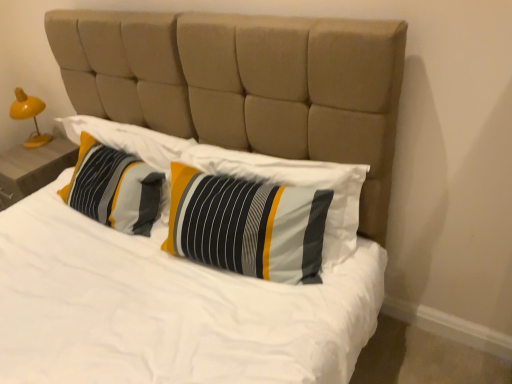
Measure the distance between point (18, 178) and camera.

The distance of point (18, 178) from camera is 2.19 meters.

At what (x,y) coordinates should I click in order to perform the action: click on yellow plastic lamp at left. Please return your answer as a coordinate pair (x, y). Looking at the image, I should click on (29, 116).

At what (x,y) coordinates should I click in order to perform the action: click on striped fabric pillow at center, the second pillow in the left-to-right sequence. Please return your answer as a coordinate pair (x, y). Looking at the image, I should click on (247, 225).

How much space does striped fabric pillow at center, which ranks as the 2th pillow in right-to-left order, occupy horizontally?

striped fabric pillow at center, which ranks as the 2th pillow in right-to-left order, is 9.61 inches in width.

At what (x,y) coordinates should I click in order to perform the action: click on yellow wood nightstand at left. Please return your answer as a coordinate pair (x, y). Looking at the image, I should click on pyautogui.click(x=33, y=168).

Can you tell me how much yellow plastic lamp at left and yellow wood nightstand at left differ in facing direction?

They differ by 1 degrees in their facing directions.

Is yellow plastic lamp at left facing away from yellow wood nightstand at left?

yellow plastic lamp at left does not have its back to yellow wood nightstand at left.

Find the location of `bedside lamp above the yellow wood nightstand at left (from the image's perspective)`. bedside lamp above the yellow wood nightstand at left (from the image's perspective) is located at coordinates (29, 116).

Looking at this image, which is closer, (16, 93) or (15, 172)?

The point (15, 172) is closer to the camera.

In terms of size, does striped fabric pillow at center, the second pillow in the left-to-right sequence, appear bigger or smaller than yellow wood nightstand at left?

striped fabric pillow at center, the second pillow in the left-to-right sequence, is smaller than yellow wood nightstand at left.

Is striped fabric pillow at center, the second pillow in the left-to-right sequence, to the left of yellow wood nightstand at left from the viewer's perspective?

In fact, striped fabric pillow at center, the second pillow in the left-to-right sequence, is to the right of yellow wood nightstand at left.

Could you tell me if striped fabric pillow at center, the second pillow in the left-to-right sequence, is turned towards yellow wood nightstand at left?

No, striped fabric pillow at center, the second pillow in the left-to-right sequence, is not turned towards yellow wood nightstand at left.

Can you confirm if striped fabric pillow at center, placed as the 1th pillow when sorted from right to left, is thinner than yellow wood nightstand at left?

Yes.

Considering the sizes of striped fabric pillow at center, which ranks as the 2th pillow in right-to-left order, and striped fabric pillow at center, placed as the 1th pillow when sorted from right to left, in the image, is striped fabric pillow at center, which ranks as the 2th pillow in right-to-left order, taller or shorter than striped fabric pillow at center, placed as the 1th pillow when sorted from right to left,?

Considering their sizes, striped fabric pillow at center, which ranks as the 2th pillow in right-to-left order, has less height than striped fabric pillow at center, placed as the 1th pillow when sorted from right to left.

Does striped fabric pillow at center, the 1th pillow viewed from the left, lie behind striped fabric pillow at center, the second pillow in the left-to-right sequence?

Yes, it is behind striped fabric pillow at center, the second pillow in the left-to-right sequence.

From the image's perspective, relative to striped fabric pillow at center, the second pillow in the left-to-right sequence, is striped fabric pillow at center, which ranks as the 2th pillow in right-to-left order, above or below?

striped fabric pillow at center, which ranks as the 2th pillow in right-to-left order, is above striped fabric pillow at center, the second pillow in the left-to-right sequence.

The image size is (512, 384). What are the coordinates of `bedside lamp that is above the striped fabric pillow at center, placed as the 1th pillow when sorted from right to left (from a real-world perspective)` in the screenshot? It's located at pos(29,116).

From a real-world perspective, is striped fabric pillow at center, the second pillow in the left-to-right sequence, above or below yellow plastic lamp at left?

Clearly, from a real-world perspective, striped fabric pillow at center, the second pillow in the left-to-right sequence, is below yellow plastic lamp at left.

Is striped fabric pillow at center, the second pillow in the left-to-right sequence, completely or partially outside of yellow plastic lamp at left?

striped fabric pillow at center, the second pillow in the left-to-right sequence, lies outside yellow plastic lamp at left's area.

Considering the positions of objects striped fabric pillow at center, the second pillow in the left-to-right sequence, and yellow plastic lamp at left in the image provided, who is more to the left, striped fabric pillow at center, the second pillow in the left-to-right sequence, or yellow plastic lamp at left?

yellow plastic lamp at left.

This screenshot has height=384, width=512. In order to click on pillow that is the 1st one when counting forward from the yellow plastic lamp at left in this screenshot , I will do `click(114, 188)`.

Is point (132, 160) closer to viewer compared to point (26, 105)?

Yes, it is.

Does striped fabric pillow at center, which ranks as the 2th pillow in right-to-left order, have a greater height compared to yellow plastic lamp at left?

Incorrect, the height of striped fabric pillow at center, which ranks as the 2th pillow in right-to-left order, is not larger of that of yellow plastic lamp at left.

In the scene shown: Between striped fabric pillow at center, the 1th pillow viewed from the left, and yellow plastic lamp at left, which one appears on the right side from the viewer's perspective?

Positioned to the right is striped fabric pillow at center, the 1th pillow viewed from the left.

Is the position of striped fabric pillow at center, the second pillow in the left-to-right sequence, more distant than that of striped fabric pillow at center, which ranks as the 2th pillow in right-to-left order?

That is False.

Is striped fabric pillow at center, placed as the 1th pillow when sorted from right to left, to the left of striped fabric pillow at center, which ranks as the 2th pillow in right-to-left order, from the viewer's perspective?

In fact, striped fabric pillow at center, placed as the 1th pillow when sorted from right to left, is to the right of striped fabric pillow at center, which ranks as the 2th pillow in right-to-left order.

Considering the sizes of objects striped fabric pillow at center, the second pillow in the left-to-right sequence, and striped fabric pillow at center, the 1th pillow viewed from the left, in the image provided, who is shorter, striped fabric pillow at center, the second pillow in the left-to-right sequence, or striped fabric pillow at center, the 1th pillow viewed from the left,?

striped fabric pillow at center, the 1th pillow viewed from the left.

Based on the photo, between striped fabric pillow at center, placed as the 1th pillow when sorted from right to left, and striped fabric pillow at center, the 1th pillow viewed from the left, which one has larger width?

Wider between the two is striped fabric pillow at center, the 1th pillow viewed from the left.

Is yellow plastic lamp at left oriented towards striped fabric pillow at center, placed as the 1th pillow when sorted from right to left?

No, yellow plastic lamp at left is not oriented towards striped fabric pillow at center, placed as the 1th pillow when sorted from right to left.

Considering the sizes of objects yellow plastic lamp at left and striped fabric pillow at center, the second pillow in the left-to-right sequence, in the image provided, who is taller, yellow plastic lamp at left or striped fabric pillow at center, the second pillow in the left-to-right sequence,?

yellow plastic lamp at left.

Consider the image. Based on their sizes in the image, would you say yellow plastic lamp at left is bigger or smaller than striped fabric pillow at center, the second pillow in the left-to-right sequence?

In the image, yellow plastic lamp at left appears to be smaller than striped fabric pillow at center, the second pillow in the left-to-right sequence.

In the scene shown: Looking at their sizes, would you say yellow plastic lamp at left is wider or thinner than striped fabric pillow at center, placed as the 1th pillow when sorted from right to left?

Considering their sizes, yellow plastic lamp at left looks slimmer than striped fabric pillow at center, placed as the 1th pillow when sorted from right to left.

I want to click on nightstand lying below the yellow plastic lamp at left (from the image's perspective), so click(x=33, y=168).

You are a GUI agent. You are given a task and a screenshot of the screen. Output one action in this format:
    pyautogui.click(x=<x>, y=<y>)
    Task: Click on the nightstand beneath the striped fabric pillow at center, placed as the 1th pillow when sorted from right to left (from a real-world perspective)
    
    Given the screenshot: What is the action you would take?
    pyautogui.click(x=33, y=168)

When comparing their distances from yellow wood nightstand at left, does striped fabric pillow at center, the second pillow in the left-to-right sequence, or yellow plastic lamp at left seem further?

striped fabric pillow at center, the second pillow in the left-to-right sequence, is positioned further to the anchor yellow wood nightstand at left.

Based on their spatial positions, is striped fabric pillow at center, the second pillow in the left-to-right sequence, or yellow wood nightstand at left further from yellow plastic lamp at left?

Among the two, striped fabric pillow at center, the second pillow in the left-to-right sequence, is located further to yellow plastic lamp at left.

Consider the image. Estimate the real-world distances between objects in this image. Which object is closer to yellow plastic lamp at left, striped fabric pillow at center, which ranks as the 2th pillow in right-to-left order, or yellow wood nightstand at left?

yellow wood nightstand at left is closer to yellow plastic lamp at left.

Based on their spatial positions, is striped fabric pillow at center, which ranks as the 2th pillow in right-to-left order, or striped fabric pillow at center, the second pillow in the left-to-right sequence, closer to yellow wood nightstand at left?

striped fabric pillow at center, which ranks as the 2th pillow in right-to-left order.

Considering their positions, is striped fabric pillow at center, which ranks as the 2th pillow in right-to-left order, positioned closer to yellow plastic lamp at left than striped fabric pillow at center, the second pillow in the left-to-right sequence?

striped fabric pillow at center, which ranks as the 2th pillow in right-to-left order, is closer to yellow plastic lamp at left.

Estimate the real-world distances between objects in this image. Which object is closer to yellow wood nightstand at left, striped fabric pillow at center, the second pillow in the left-to-right sequence, or striped fabric pillow at center, which ranks as the 2th pillow in right-to-left order?

Among the two, striped fabric pillow at center, which ranks as the 2th pillow in right-to-left order, is located nearer to yellow wood nightstand at left.

Considering their positions, is yellow plastic lamp at left positioned further to yellow wood nightstand at left than striped fabric pillow at center, which ranks as the 2th pillow in right-to-left order?

striped fabric pillow at center, which ranks as the 2th pillow in right-to-left order.

When comparing their distances from yellow wood nightstand at left, does striped fabric pillow at center, the 1th pillow viewed from the left, or yellow plastic lamp at left seem further?

striped fabric pillow at center, the 1th pillow viewed from the left, is further to yellow wood nightstand at left.

Locate an element on the screen. pillow situated between yellow plastic lamp at left and striped fabric pillow at center, placed as the 1th pillow when sorted from right to left, from left to right is located at coordinates (114, 188).

Locate an element on the screen. The height and width of the screenshot is (384, 512). pillow located between yellow wood nightstand at left and striped fabric pillow at center, the second pillow in the left-to-right sequence, in the left-right direction is located at coordinates (114, 188).

The height and width of the screenshot is (384, 512). What are the coordinates of `nightstand between striped fabric pillow at center, which ranks as the 2th pillow in right-to-left order, and yellow plastic lamp at left in the front-back direction` in the screenshot? It's located at (33, 168).

Find the location of a particular element. nightstand located between yellow plastic lamp at left and striped fabric pillow at center, placed as the 1th pillow when sorted from right to left, in the left-right direction is located at coordinates (33, 168).